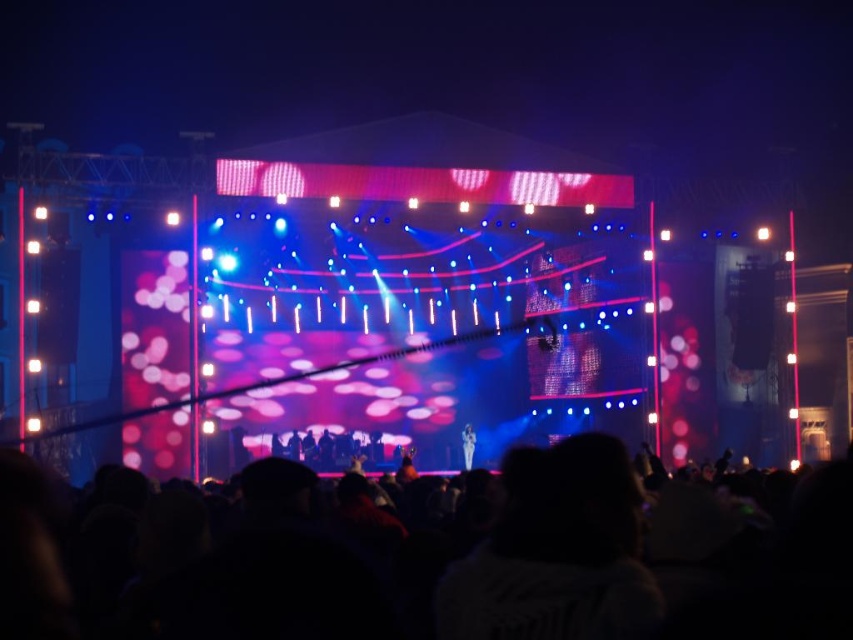
Based on the photo, you are a sound engineer at the concert venue. The sound system requires that the crowd at lower center must be within 40 meters to ensure optimal audio quality. Can the current setup between the black matte crowd at lower center and the shiny silver microphone at center meet this requirement?

The distance between the black matte crowd at lower center and the shiny silver microphone at center is 39.11 meters, which is within the 40 meters requirement. Therefore, the current setup meets the audio quality criteria.

You are a stagehand at the concert. You need to adjust the lighting so that the shiny silver microphone at center is fully visible without obstruction. Considering the black matte crowd at lower center, which object might block the view of the microphone and why?

The black matte crowd at lower center might block the view of the shiny silver microphone at center because it has a greater height than the microphone, potentially obscuring it from certain angles.

You are a photographer at the concert. You want to take a photo that includes both the black matte crowd at lower center and the shiny silver microphone at center. From the photographer perspective, which object should be placed on the right side of the photo?

The black matte crowd at lower center should be placed on the right side of the photo because it is to the right of the shiny silver microphone at center according to the description.